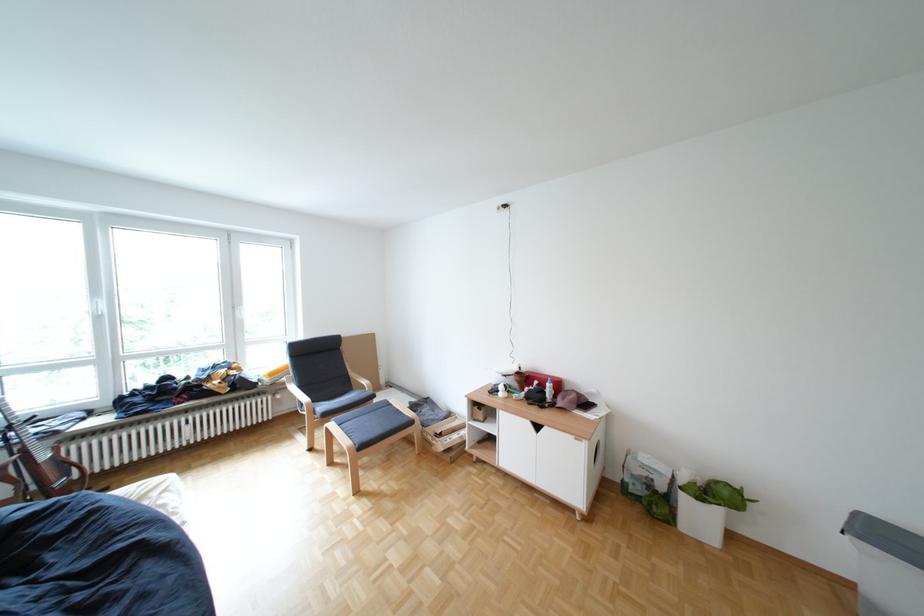
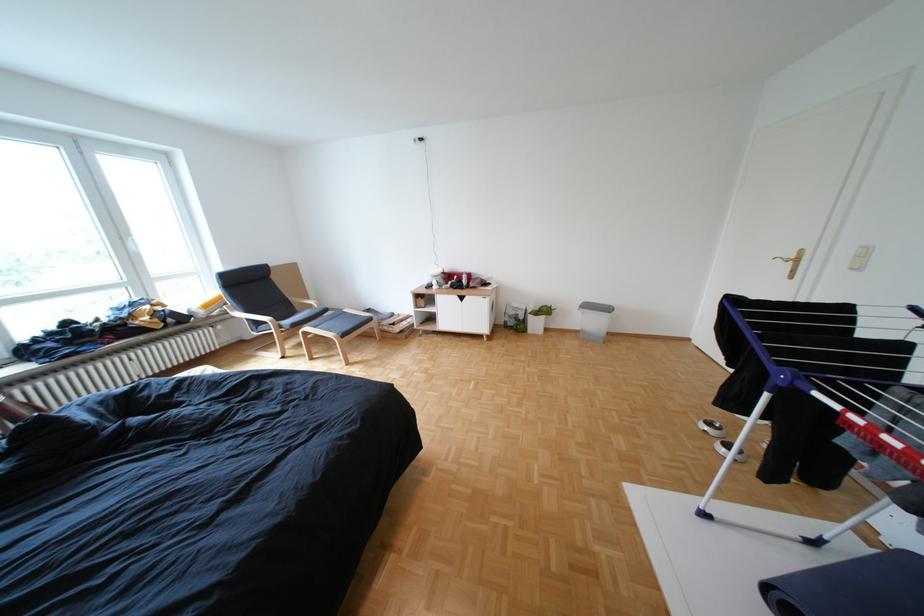
In a continuous first-person perspective shot, in which direction is the camera moving?

The cameraman walked toward left, backward.